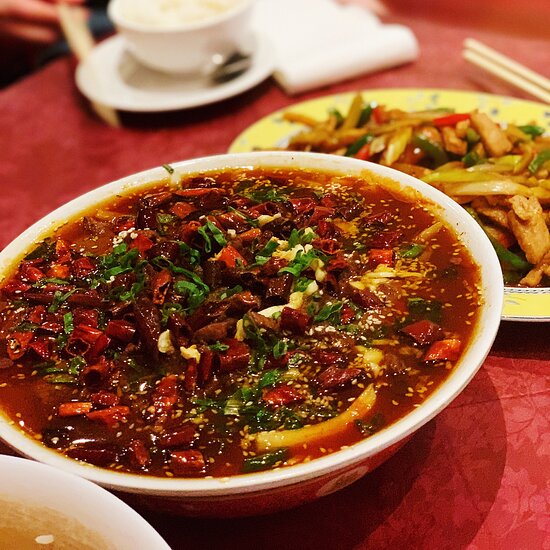
What are the coordinates of `red jacquard woven tablecloth` in the screenshot? It's located at (494, 474).